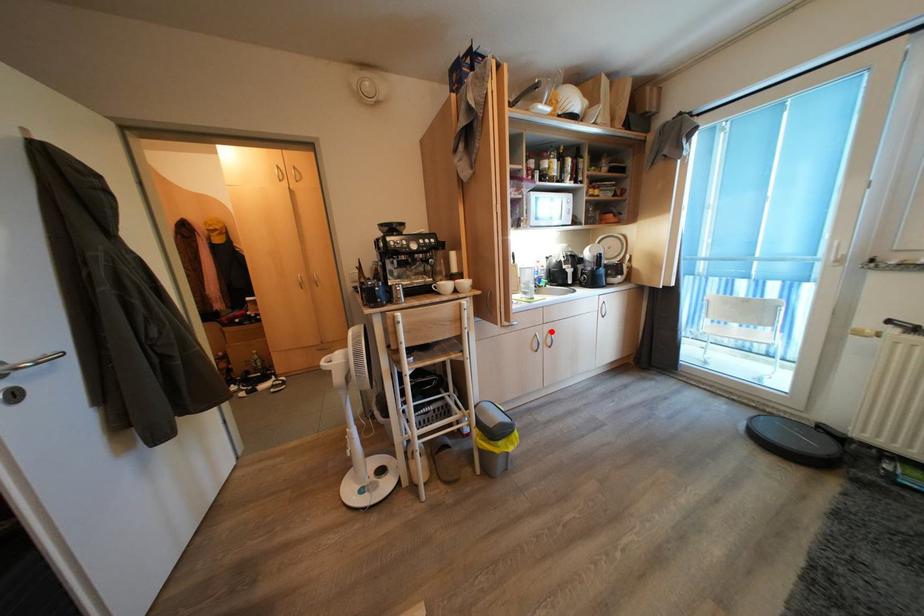
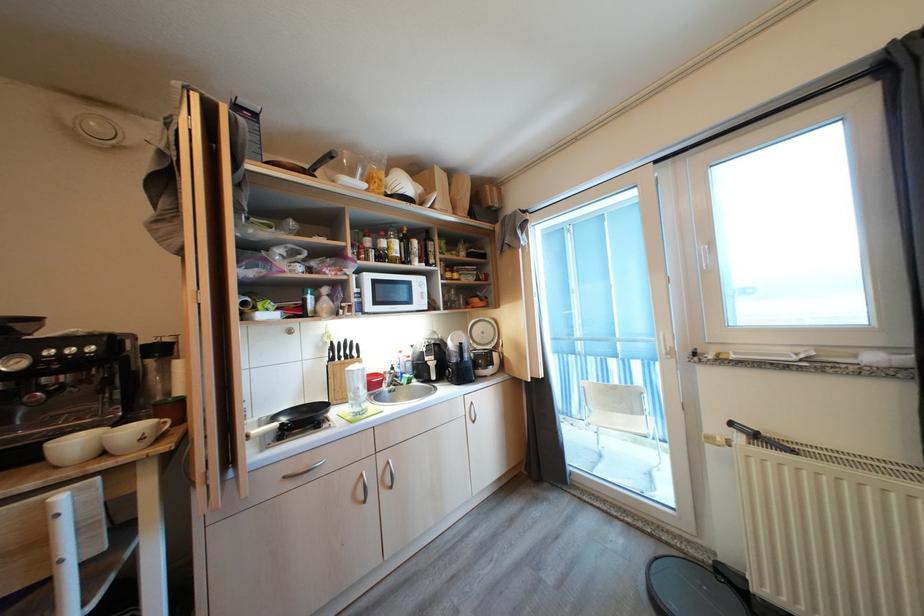
Question: A red point is marked in image1. In image2, is the corresponding 3D point closer to the camera or farther? Reply with the corresponding letter.

Choices:
 (A) The corresponding 3D point is closer.
 (B) The corresponding 3D point is farther.

Answer: (B)